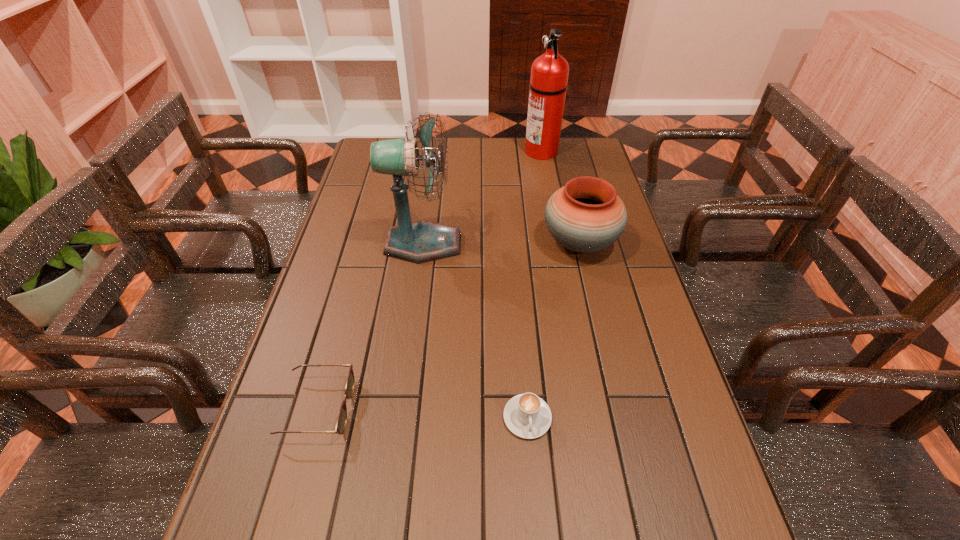
Where is `vacant space that's between the farthest object and the spectacles`? The height and width of the screenshot is (540, 960). vacant space that's between the farthest object and the spectacles is located at coordinates (430, 280).

Identify which object is located as the third nearest to the pottery. Please provide its 2D coordinates. Your answer should be formatted as a tuple, i.e. [(x, y)], where the tuple contains the x and y coordinates of a point satisfying the conditions above.

[(526, 415)]

The width and height of the screenshot is (960, 540). Find the location of `object that ranks as the closest to the pottery`. object that ranks as the closest to the pottery is located at coordinates (422, 241).

Find the location of a particular element. This screenshot has height=540, width=960. vacant point that satisfies the following two spatial constraints: 1. at the nozzle of the farthest object; 2. on the back side of the third tallest object is located at coordinates (559, 243).

This screenshot has width=960, height=540. Find the location of `vacant region that satisfies the following two spatial constraints: 1. on the front side of the pottery; 2. in front of the fan where the wind blows`. vacant region that satisfies the following two spatial constraints: 1. on the front side of the pottery; 2. in front of the fan where the wind blows is located at coordinates (580, 244).

Where is `vacant space that satisfies the following two spatial constraints: 1. at the nozzle of the fire extinguisher; 2. to the right of the cappuccino`? vacant space that satisfies the following two spatial constraints: 1. at the nozzle of the fire extinguisher; 2. to the right of the cappuccino is located at coordinates (590, 417).